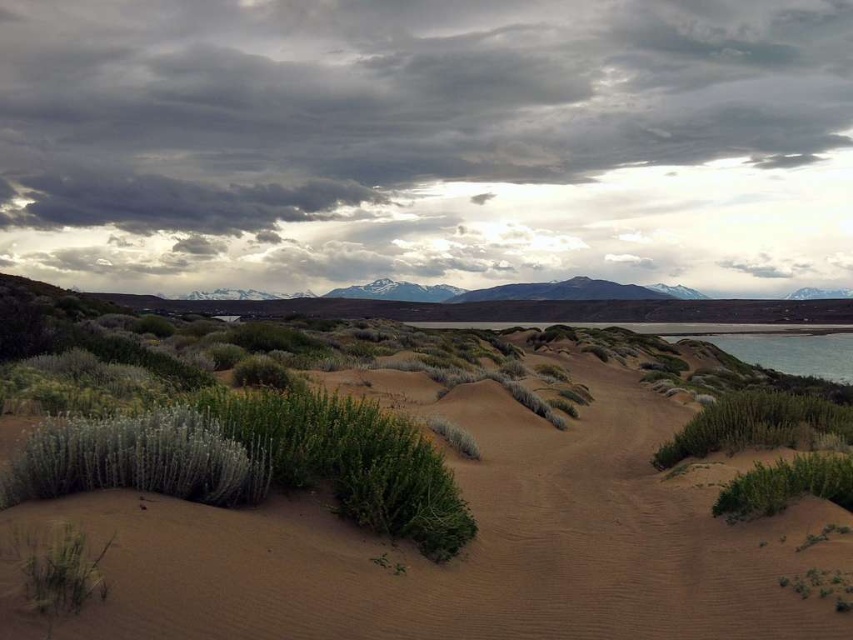
Question: Which of the following is the farthest from the observer?

Choices:
 (A) 648,392
 (B) 96,570
 (C) 184,467

Answer: (A)

Question: Can you confirm if sandy/dry sand at lower center is wider than green fuzzy bush at lower left?

Choices:
 (A) no
 (B) yes

Answer: (B)

Question: Which object is positioned farthest from the green fuzzy bush at lower left?

Choices:
 (A) sandy/dry sand at lower center
 (B) green leafy bush at lower right

Answer: (B)

Question: Is sandy/dry sand at lower center below green leafy bush at lower left?

Choices:
 (A) yes
 (B) no

Answer: (A)

Question: Can you confirm if sandy/dry sand at lower center is wider than green leafy bush at lower right?

Choices:
 (A) no
 (B) yes

Answer: (A)

Question: Which object is the closest to the green leafy bush at lower left?

Choices:
 (A) sandy/dry sand at lower center
 (B) green leafy bush at lower right

Answer: (A)